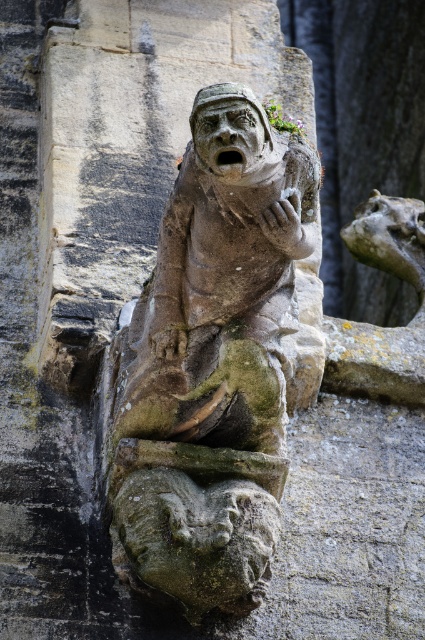
Question: Which object is farther from the camera taking this photo?

Choices:
 (A) stone gargoyle at center
 (B) matte stone face at center

Answer: (A)

Question: Which of the following is the closest to the observer?

Choices:
 (A) stone gargoyle at center
 (B) matte stone face at center

Answer: (B)

Question: Can you confirm if stone gargoyle at center is positioned above matte stone face at center?

Choices:
 (A) yes
 (B) no

Answer: (B)

Question: Among these points, which one is nearest to the camera?

Choices:
 (A) (234, 182)
 (B) (218, 554)

Answer: (A)

Question: Is stone gargoyle at center positioned at the back of matte stone face at center?

Choices:
 (A) no
 (B) yes

Answer: (B)

Question: Is stone gargoyle at center wider than matte stone face at center?

Choices:
 (A) yes
 (B) no

Answer: (A)